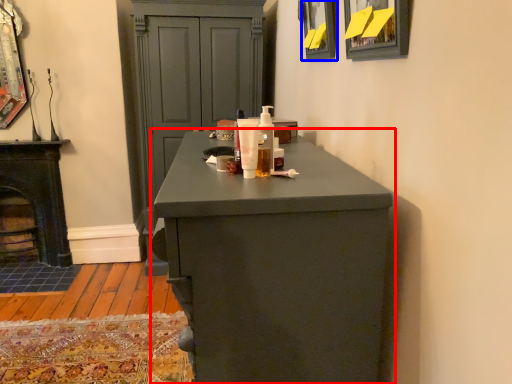
Question: Which of the following is the closest to the observer, chest of drawers (highlighted by a red box) or picture frame (highlighted by a blue box)?

Choices:
 (A) chest of drawers
 (B) picture frame

Answer: (A)